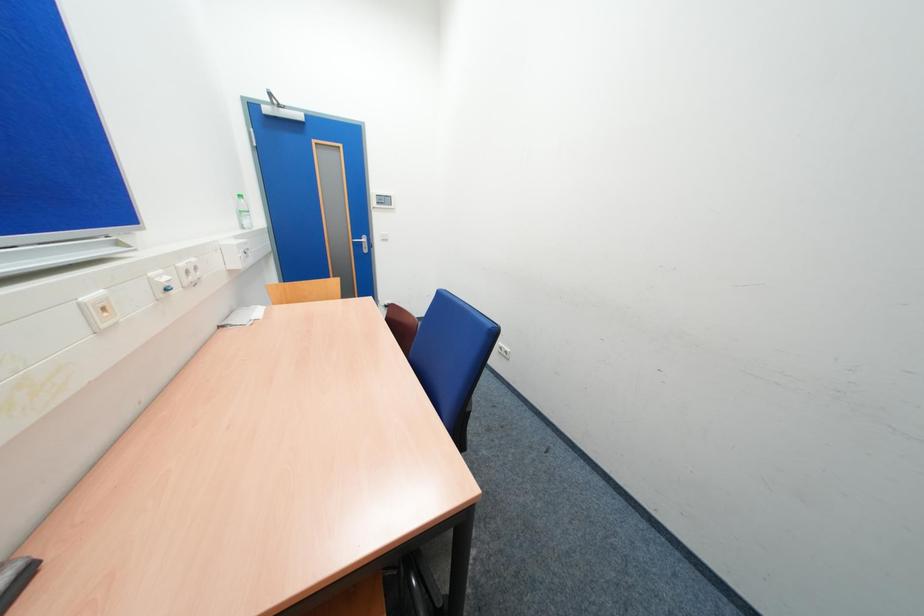
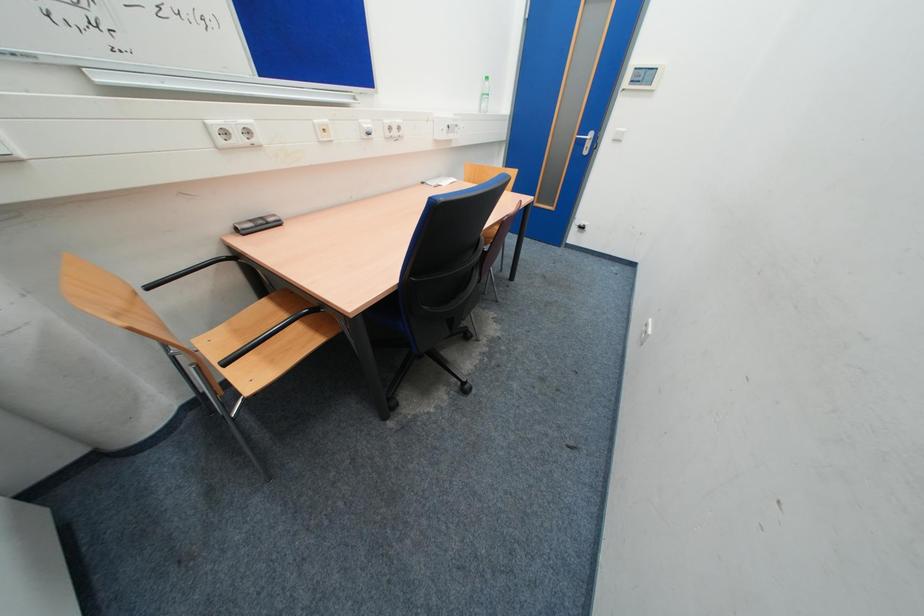
Based on the continuous images, in which direction is the camera rotating?

The rotation direction of the camera is left-down.